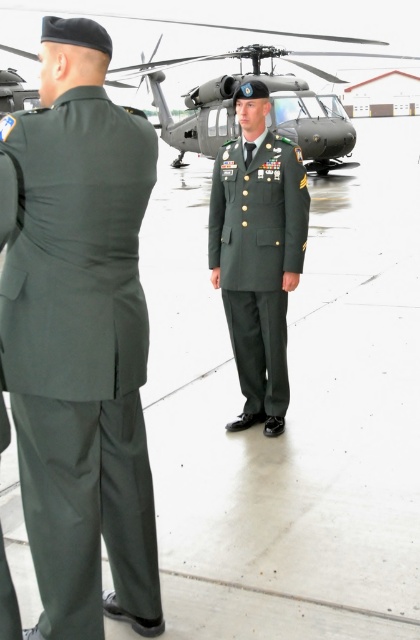
You are a photographer trying to capture a photo of the green fabric uniform at back and the metallic gray helicopter at center. Which object should you focus on first if you want to ensure both are in the frame without moving the camera?

You should focus on the metallic gray helicopter at center first because it is taller than the green fabric uniform at back, ensuring it fits within the frame.

You are a military engineer tasked with transporting both the metallic gray helicopter at center and the green matte uniform at center onto a flatbed truck. The truck has a maximum width capacity of 3 meters. If the helicopter is wider than the uniform, can both items be placed side by side without exceeding the truck bed width?

The metallic gray helicopter at center is wider than the green matte uniform at center. Since the helicopter is wider and the truck bed is only 3 meters wide, placing both side by side may not be possible unless the combined width of both items is within the 3 meters limit. However, without specific measurements, it is impossible to confirm if they will fit together.